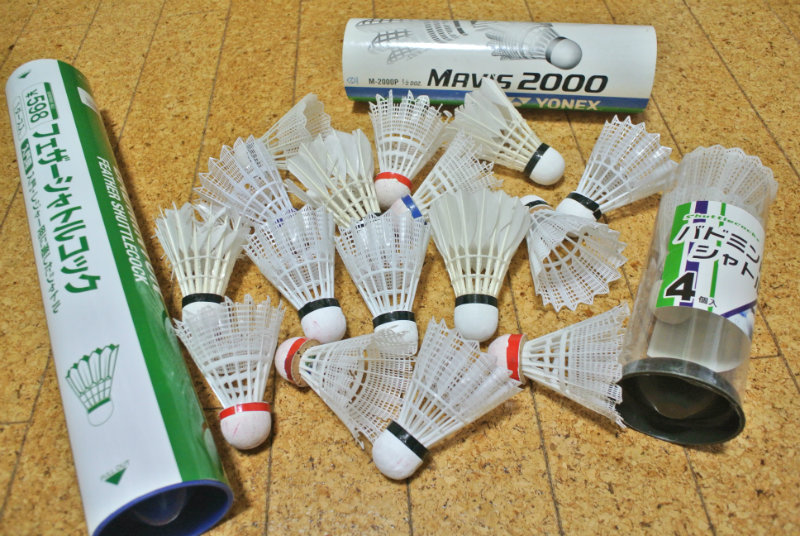
I want to click on box, so click(590, 65).